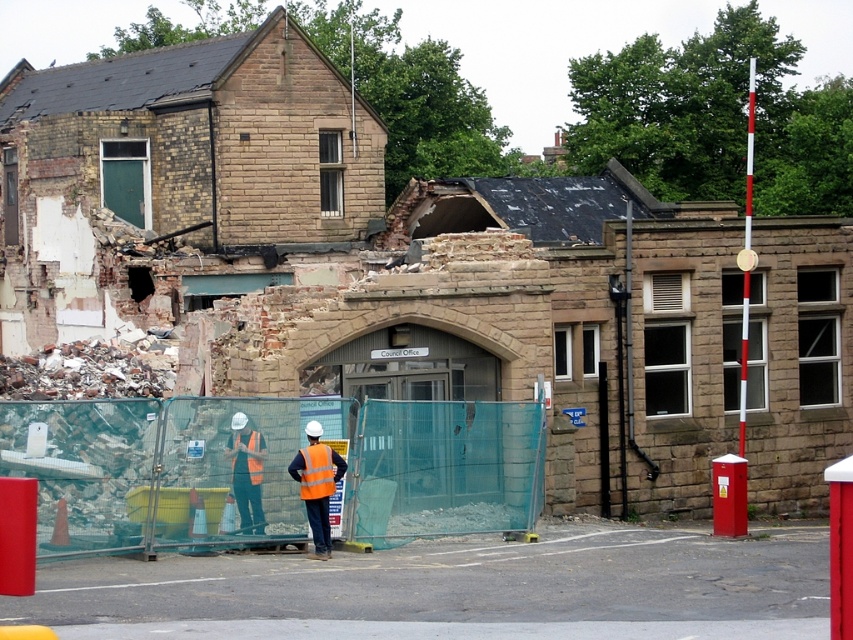
You are a safety inspector who needs to check the distance between the high visibility vest at center and the orange reflective safety vest at center. According to safety regulations, the minimum distance between two safety vests in a construction site should be at least 36 inches. Is the current distance compliant with the regulation?

The high visibility vest at center and orange reflective safety vest at center are 34.01 inches apart from each other, which is less than the required 36 inches. Therefore, the current distance does not comply with the safety regulations.